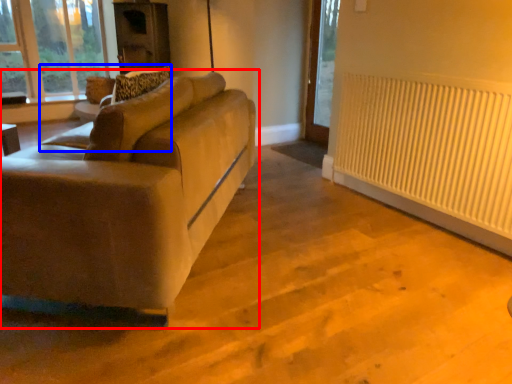
Question: Which object appears closest to the camera in this image, studio couch (highlighted by a red box) or swivel chair (highlighted by a blue box)?

Choices:
 (A) studio couch
 (B) swivel chair

Answer: (A)